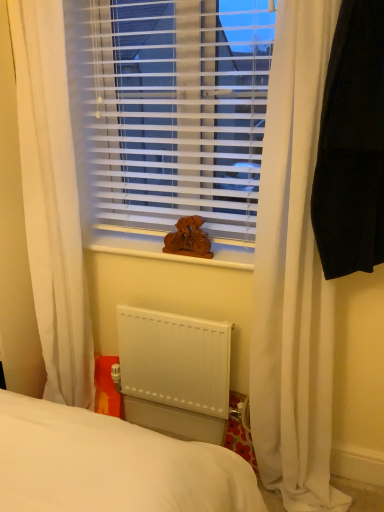
Question: Is wooden statue at center not near white plastic blinds at center?

Choices:
 (A) no
 (B) yes

Answer: (A)

Question: From a real-world perspective, is wooden statue at center over white plastic blinds at center?

Choices:
 (A) no
 (B) yes

Answer: (A)

Question: From a real-world perspective, is wooden statue at center beneath white plastic blinds at center?

Choices:
 (A) no
 (B) yes

Answer: (B)

Question: Is wooden statue at center at the right side of white plastic blinds at center?

Choices:
 (A) no
 (B) yes

Answer: (B)

Question: Is wooden statue at center at the left side of white plastic blinds at center?

Choices:
 (A) yes
 (B) no

Answer: (B)

Question: From the image's perspective, is white matte radiator at lower center positioned above or below wooden statue at center?

Choices:
 (A) below
 (B) above

Answer: (A)

Question: Considering the positions of white matte radiator at lower center and wooden statue at center in the image, is white matte radiator at lower center wider or thinner than wooden statue at center?

Choices:
 (A) thin
 (B) wide

Answer: (B)

Question: Is white matte radiator at lower center inside or outside of wooden statue at center?

Choices:
 (A) outside
 (B) inside

Answer: (A)

Question: In terms of height, does white matte radiator at lower center look taller or shorter compared to wooden statue at center?

Choices:
 (A) short
 (B) tall

Answer: (B)

Question: From a real-world perspective, is white matte radiator at lower center physically located above or below black fabric at right, the second curtain from the left?

Choices:
 (A) above
 (B) below

Answer: (B)

Question: Is white matte radiator at lower center wider or thinner than black fabric at right, marked as the first curtain in a right-to-left arrangement?

Choices:
 (A) wide
 (B) thin

Answer: (B)

Question: Relative to black fabric at right, marked as the first curtain in a right-to-left arrangement, is white matte radiator at lower center in front or behind?

Choices:
 (A) front
 (B) behind

Answer: (B)

Question: Does point (142, 320) appear closer or farther from the camera than point (382, 30)?

Choices:
 (A) farther
 (B) closer

Answer: (A)

Question: From their relative heights in the image, would you say wooden statue at center is taller or shorter than white plastic blinds at center?

Choices:
 (A) short
 (B) tall

Answer: (A)

Question: In the image, is wooden statue at center on the left side or the right side of white plastic blinds at center?

Choices:
 (A) right
 (B) left

Answer: (A)